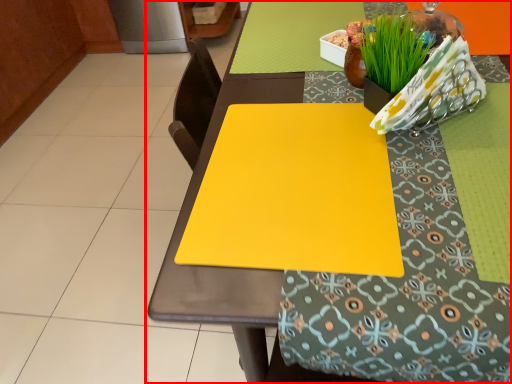
Question: From the image, what is the correct spatial relationship of table (annotated by the red box) in relation to sheet?

Choices:
 (A) left
 (B) right

Answer: (B)